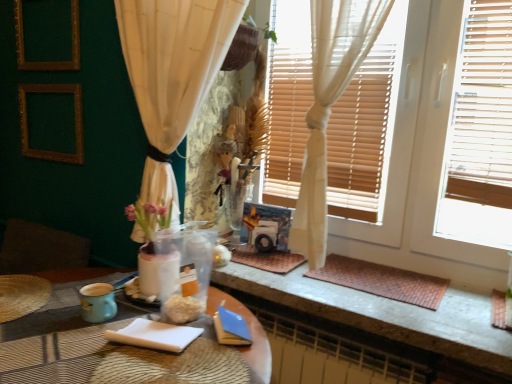
Question: Does teal ceramic mug at lower left have a greater width compared to white paper notepad at lower center?

Choices:
 (A) yes
 (B) no

Answer: (B)

Question: Does teal ceramic mug at lower left have a smaller size compared to white paper notepad at lower center?

Choices:
 (A) yes
 (B) no

Answer: (A)

Question: Is teal ceramic mug at lower left surrounding white paper notepad at lower center?

Choices:
 (A) yes
 (B) no

Answer: (B)

Question: Could you tell me if teal ceramic mug at lower left is facing white paper notepad at lower center?

Choices:
 (A) no
 (B) yes

Answer: (A)

Question: Is the surface of teal ceramic mug at lower left in direct contact with white paper notepad at lower center?

Choices:
 (A) yes
 (B) no

Answer: (B)

Question: Would you consider teal ceramic mug at lower left to be distant from white paper notepad at lower center?

Choices:
 (A) yes
 (B) no

Answer: (B)

Question: From the image's perspective, would you say white wood window frame at upper right is shown under teal ceramic mug at lower left?

Choices:
 (A) yes
 (B) no

Answer: (B)

Question: From the image's perspective, is white wood window frame at upper right on top of teal ceramic mug at lower left?

Choices:
 (A) yes
 (B) no

Answer: (A)

Question: Is white wood window frame at upper right at the left side of teal ceramic mug at lower left?

Choices:
 (A) no
 (B) yes

Answer: (A)

Question: Are white wood window frame at upper right and teal ceramic mug at lower left beside each other?

Choices:
 (A) yes
 (B) no

Answer: (B)

Question: Does white wood window frame at upper right have a lesser height compared to teal ceramic mug at lower left?

Choices:
 (A) yes
 (B) no

Answer: (B)

Question: Can you confirm if white wood window frame at upper right is taller than teal ceramic mug at lower left?

Choices:
 (A) yes
 (B) no

Answer: (A)

Question: Is brown woven mat at lower right at the right side of white wood window frame at upper right?

Choices:
 (A) no
 (B) yes

Answer: (B)